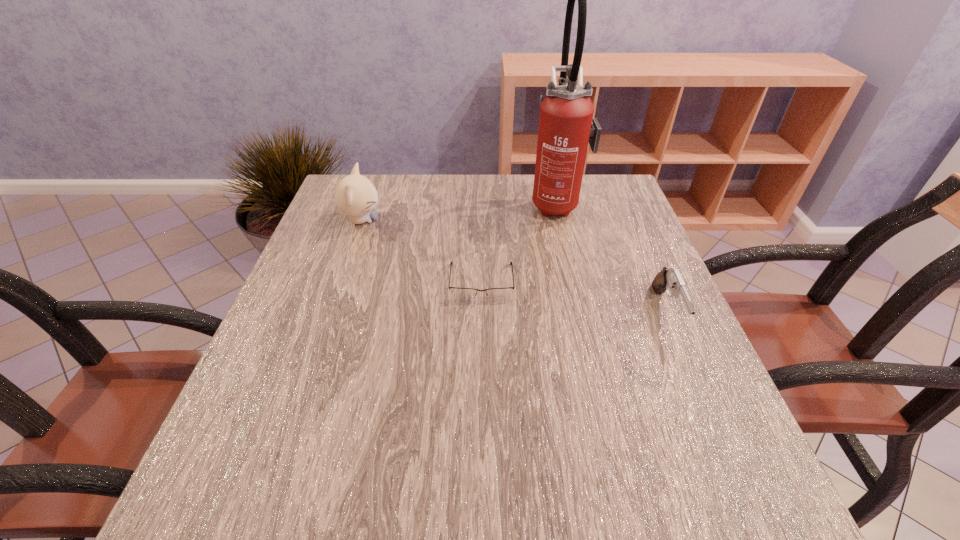
Where is `free space between the third shortest object and the fire extinguisher`? free space between the third shortest object and the fire extinguisher is located at coordinates (459, 212).

Identify the location of empty location between the second shortest object and the shortest object. (574, 297).

Identify the location of free space between the rightmost object and the kitten. (514, 266).

I want to click on free space between the shortest object and the leftmost object, so click(421, 251).

Where is `unoccupied area between the third tallest object and the third object from left to right`? The image size is (960, 540). unoccupied area between the third tallest object and the third object from left to right is located at coordinates (612, 258).

Image resolution: width=960 pixels, height=540 pixels. What are the coordinates of `free spot between the rightmost object and the fire extinguisher` in the screenshot? It's located at (612, 258).

Find the location of a particular element. The image size is (960, 540). the second closest object to the third object from left to right is located at coordinates (670, 277).

Identify which object is the third nearest to the shortest object. Please provide its 2D coordinates. Your answer should be formatted as a tuple, i.e. [(x, y)], where the tuple contains the x and y coordinates of a point satisfying the conditions above.

[(670, 277)]

This screenshot has width=960, height=540. In order to click on blank space that satisfies the following two spatial constraints: 1. at the nozzle of the tallest object; 2. on the front-facing side of the second object from left to right in this screenshot , I will do `click(575, 282)`.